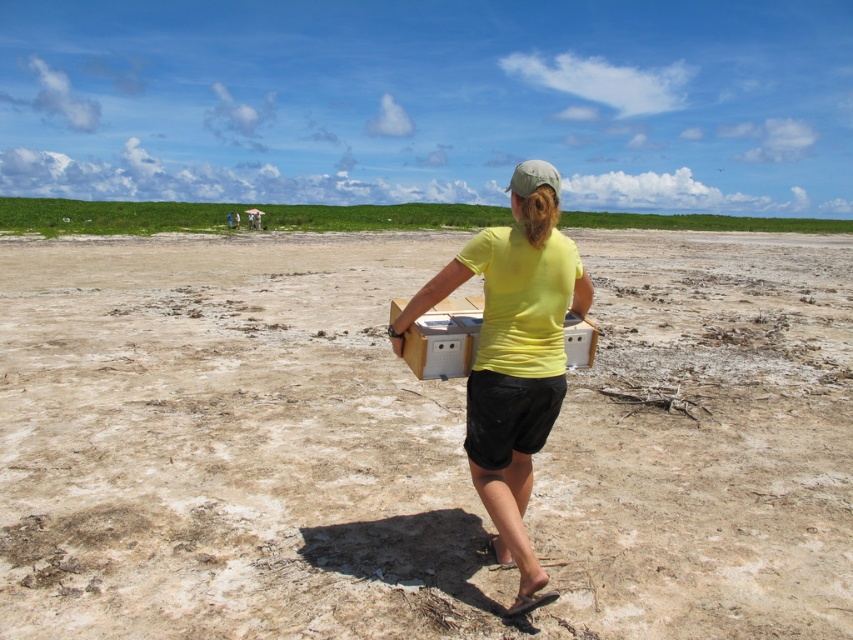
Is black cotton shorts at lower center smaller than wooden box at center?

Correct, black cotton shorts at lower center occupies less space than wooden box at center.

Is point (506, 396) behind point (456, 308)?

No, (506, 396) is closer to viewer.

Is point (496, 387) closer to viewer compared to point (442, 328)?

Yes, it is.

Locate an element on the screen. This screenshot has width=853, height=640. black cotton shorts at lower center is located at coordinates (508, 416).

Can you confirm if matte cardboard box at center is thinner than black cotton shorts at lower center?

In fact, matte cardboard box at center might be wider than black cotton shorts at lower center.

Where is `matte cardboard box at center`? matte cardboard box at center is located at coordinates (230, 444).

Does matte cardboard box at center appear under wooden box at center?

No, matte cardboard box at center is not below wooden box at center.

Measure the distance from matte cardboard box at center to wooden box at center.

matte cardboard box at center and wooden box at center are 7.88 meters apart from each other.

This screenshot has width=853, height=640. What do you see at coordinates (230, 444) in the screenshot?
I see `matte cardboard box at center` at bounding box center [230, 444].

Identify the location of matte cardboard box at center. This screenshot has height=640, width=853. (230, 444).